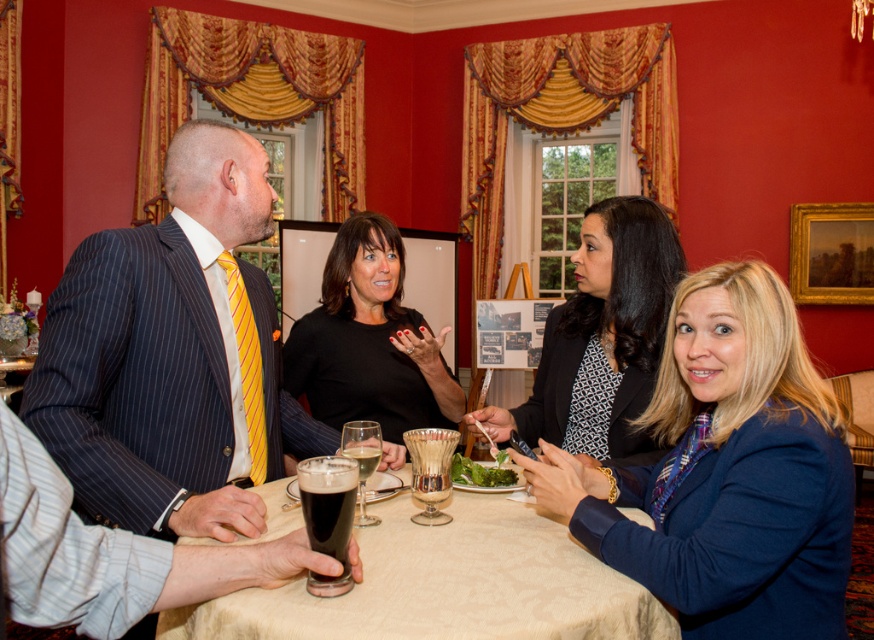
You are a guest at this event and need to place your phone on the table. The blue fabric jacket at lower right and the translucent glass at center are on the table. Which object is wider so you can choose the larger surface?

The blue fabric jacket at lower right might be wider than translucent glass at center, so it could provide a wider surface for placing your phone.

You are organizing a charity event and need to place a decorative centerpiece on the table. The existing items on the table are the matte black blazer at center and the translucent glass at center. Which item should you move to make space for the centerpiece, and why?

You should move the matte black blazer at center because it is bigger than the translucent glass at center, making it easier to relocate to free up more space for the centerpiece.

You are a photographer at the event and want to capture a photo of the matte black blazer at center and the black matte shirt at center. Which object should you focus on first if you want to include both in the frame without moving the camera?

The matte black blazer at center is positioned under the black matte shirt at center, so you should focus on the black matte shirt at center first to ensure both are in the frame without moving the camera.